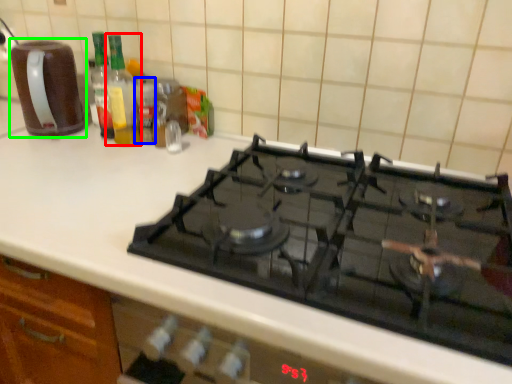
Question: Estimate the real-world distances between objects in this image. Which object is closer to bottle (highlighted by a red box), bottle (highlighted by a blue box) or kitchen appliance (highlighted by a green box)?

Choices:
 (A) bottle
 (B) kitchen appliance

Answer: (A)